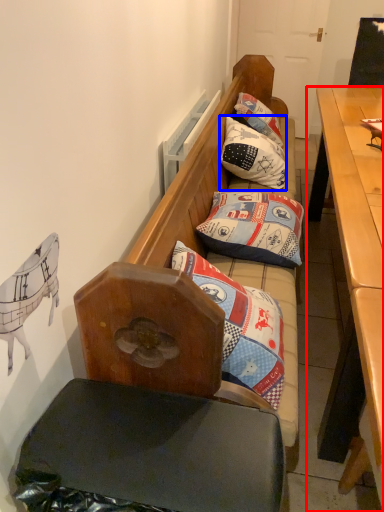
Question: Which object appears farthest to the camera in this image, desk (highlighted by a red box) or pillow (highlighted by a blue box)?

Choices:
 (A) desk
 (B) pillow

Answer: (B)